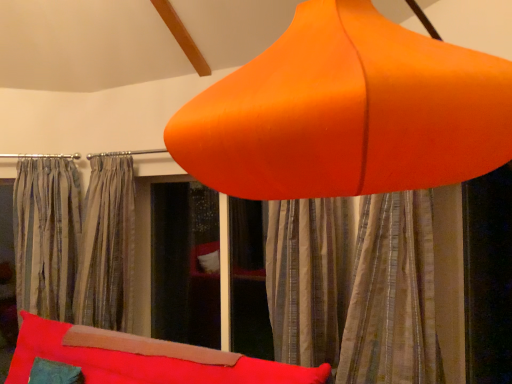
Question: Is silky gray curtains at center, which is counted as the second curtain, starting from the front, positioned beyond the bounds of orange matte lampshade at upper center?

Choices:
 (A) no
 (B) yes

Answer: (B)

Question: Does silky gray curtains at center, placed as the 1th curtain when sorted from back to front, have a larger size compared to orange matte lampshade at upper center?

Choices:
 (A) no
 (B) yes

Answer: (A)

Question: Is the position of silky gray curtains at center, the 1th curtain in the left-to-right sequence, less distant than that of orange matte lampshade at upper center?

Choices:
 (A) no
 (B) yes

Answer: (A)

Question: Considering the relative sizes of silky gray curtains at center, the 1th curtain in the left-to-right sequence, and orange matte lampshade at upper center in the image provided, is silky gray curtains at center, the 1th curtain in the left-to-right sequence, wider than orange matte lampshade at upper center?

Choices:
 (A) no
 (B) yes

Answer: (A)

Question: From a real-world perspective, is silky gray curtains at center, the second curtain when ordered from right to left, positioned over orange matte lampshade at upper center based on gravity?

Choices:
 (A) no
 (B) yes

Answer: (A)

Question: From the image's perspective, does silky gray curtains at center, the 1th curtain in the left-to-right sequence, appear lower than orange matte lampshade at upper center?

Choices:
 (A) no
 (B) yes

Answer: (B)

Question: Considering the relative positions of velvet red bean bag at lower center and silky gray curtains at center, the second curtain when ordered from right to left, in the image provided, is velvet red bean bag at lower center behind silky gray curtains at center, the second curtain when ordered from right to left,?

Choices:
 (A) yes
 (B) no

Answer: (B)

Question: Does velvet red bean bag at lower center lie in front of silky gray curtains at center, the second curtain when ordered from right to left?

Choices:
 (A) no
 (B) yes

Answer: (B)

Question: Is velvet red bean bag at lower center shorter than silky gray curtains at center, which is counted as the second curtain, starting from the front?

Choices:
 (A) no
 (B) yes

Answer: (B)

Question: Considering the relative sizes of velvet red bean bag at lower center and silky gray curtains at center, placed as the 1th curtain when sorted from back to front, in the image provided, is velvet red bean bag at lower center bigger than silky gray curtains at center, placed as the 1th curtain when sorted from back to front,?

Choices:
 (A) yes
 (B) no

Answer: (A)

Question: Is velvet red bean bag at lower center wider than silky gray curtains at center, which is counted as the second curtain, starting from the front?

Choices:
 (A) no
 (B) yes

Answer: (B)

Question: Is velvet red bean bag at lower center placed right next to silky gray curtains at center, the 1th curtain in the left-to-right sequence?

Choices:
 (A) no
 (B) yes

Answer: (A)

Question: Is orange matte lampshade at upper center to the left of silky gray curtains at center, the second curtain when ordered from right to left, from the viewer's perspective?

Choices:
 (A) no
 (B) yes

Answer: (A)